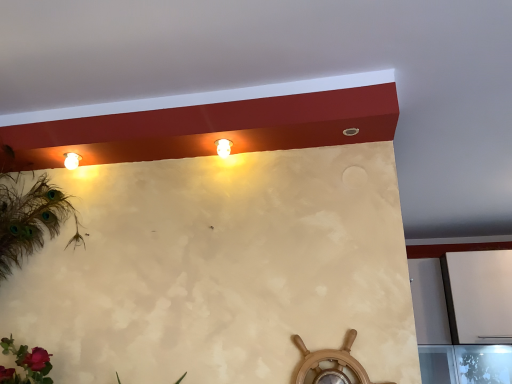
In order to face matte white lamp at upper left, should I rotate leftwards or rightwards?

To face it directly, rotate left by 23.416 degrees.

Describe the element at coordinates (71, 160) in the screenshot. This screenshot has height=384, width=512. I see `matte white lamp at upper left` at that location.

This screenshot has width=512, height=384. Find the location of `matte white lamp at upper left`. matte white lamp at upper left is located at coordinates (71, 160).

Measure the distance between point (66, 153) and camera.

They are 5.65 feet apart.

The image size is (512, 384). Describe the element at coordinates (223, 147) in the screenshot. I see `white glossy light fixture at upper center` at that location.

At what (x,y) coordinates should I click in order to perform the action: click on white glossy light fixture at upper center. Please return your answer as a coordinate pair (x, y). Looking at the image, I should click on (223, 147).

What is the approximate width of white glossy light fixture at upper center?

white glossy light fixture at upper center is 2.79 inches in width.

Find the location of a particular element. The image size is (512, 384). matte white lamp at upper left is located at coordinates point(71,160).

Consider the image. Based on their positions, is matte white lamp at upper left located to the left or right of white glossy light fixture at upper center?

matte white lamp at upper left is positioned on white glossy light fixture at upper center's left side.

Who is more distant, matte white lamp at upper left or white glossy light fixture at upper center?

matte white lamp at upper left is behind.

Is point (77, 157) closer or farther from the camera than point (229, 154)?

Point (77, 157) is positioned farther from the camera compared to point (229, 154).

From the image's perspective, is matte white lamp at upper left located beneath white glossy light fixture at upper center?

Indeed, from the image's perspective, matte white lamp at upper left is shown beneath white glossy light fixture at upper center.

From a real-world perspective, is matte white lamp at upper left above or below white glossy light fixture at upper center?

From a real-world perspective, matte white lamp at upper left is physically above white glossy light fixture at upper center.

Considering the sizes of objects matte white lamp at upper left and white glossy light fixture at upper center in the image provided, who is thinner, matte white lamp at upper left or white glossy light fixture at upper center?

matte white lamp at upper left.

Does matte white lamp at upper left have a lesser height compared to white glossy light fixture at upper center?

In fact, matte white lamp at upper left may be taller than white glossy light fixture at upper center.

Looking at this image, who is smaller, matte white lamp at upper left or white glossy light fixture at upper center?

matte white lamp at upper left is smaller.

Consider the image. Choose the correct answer: Is matte white lamp at upper left inside white glossy light fixture at upper center or outside it?

matte white lamp at upper left exists outside the volume of white glossy light fixture at upper center.

Is matte white lamp at upper left touching white glossy light fixture at upper center?

No, matte white lamp at upper left is not touching white glossy light fixture at upper center.

Is matte white lamp at upper left oriented away from white glossy light fixture at upper center?

No, matte white lamp at upper left's orientation is not away from white glossy light fixture at upper center.

Measure the distance between matte white lamp at upper left and white glossy light fixture at upper center.

matte white lamp at upper left and white glossy light fixture at upper center are 24.01 inches apart from each other.

This screenshot has width=512, height=384. In order to click on fixture that is above the matte white lamp at upper left (from the image's perspective) in this screenshot , I will do `click(223, 147)`.

Looking at this image, is white glossy light fixture at upper center to the right of matte white lamp at upper left from the viewer's perspective?

Yes, white glossy light fixture at upper center is to the right of matte white lamp at upper left.

In the image, is white glossy light fixture at upper center positioned in front of or behind matte white lamp at upper left?

white glossy light fixture at upper center is positioned closer to the viewer than matte white lamp at upper left.

Which is in front, point (216, 147) or point (68, 155)?

The point (216, 147) is more forward.

From the image's perspective, which is above, white glossy light fixture at upper center or matte white lamp at upper left?

white glossy light fixture at upper center is shown above in the image.

From a real-world perspective, is white glossy light fixture at upper center physically located above or below matte white lamp at upper left?

Clearly, from a real-world perspective, white glossy light fixture at upper center is below matte white lamp at upper left.

Considering the relative sizes of white glossy light fixture at upper center and matte white lamp at upper left in the image provided, is white glossy light fixture at upper center wider than matte white lamp at upper left?

Indeed, white glossy light fixture at upper center has a greater width compared to matte white lamp at upper left.

Does white glossy light fixture at upper center have a greater height compared to matte white lamp at upper left?

In fact, white glossy light fixture at upper center may be shorter than matte white lamp at upper left.

Looking at the image, does white glossy light fixture at upper center seem bigger or smaller compared to matte white lamp at upper left?

white glossy light fixture at upper center is bigger than matte white lamp at upper left.

Is white glossy light fixture at upper center outside of matte white lamp at upper left?

white glossy light fixture at upper center lies outside matte white lamp at upper left's area.

Would you consider white glossy light fixture at upper center to be distant from matte white lamp at upper left?

white glossy light fixture at upper center is near matte white lamp at upper left, not far away.

Consider the image. Is white glossy light fixture at upper center facing towards matte white lamp at upper left?

No, white glossy light fixture at upper center does not turn towards matte white lamp at upper left.

How many degrees apart are the facing directions of white glossy light fixture at upper center and matte white lamp at upper left?

The angle between the facing direction of white glossy light fixture at upper center and the facing direction of matte white lamp at upper left is 0.000182 degrees.

How distant is white glossy light fixture at upper center from matte white lamp at upper left?

They are 24.01 inches apart.

Find the location of a particular element. fixture above the matte white lamp at upper left (from the image's perspective) is located at coordinates (223, 147).

Find the location of a particular element. This screenshot has width=512, height=384. fixture below the matte white lamp at upper left (from a real-world perspective) is located at coordinates (223, 147).

This screenshot has height=384, width=512. What are the coordinates of `fixture lying above the matte white lamp at upper left (from the image's perspective)` in the screenshot? It's located at (223, 147).